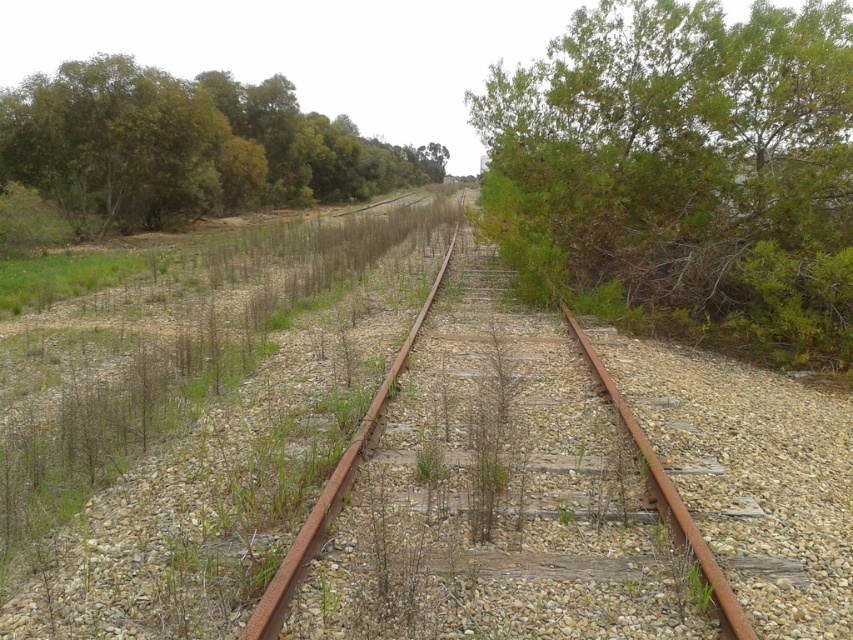
Question: Does rusty metal track at center have a larger size compared to green leafy tree at upper left?

Choices:
 (A) yes
 (B) no

Answer: (B)

Question: Does rusty metal track at center appear on the right side of green leafy tree at upper left?

Choices:
 (A) no
 (B) yes

Answer: (B)

Question: Which of the following is the closest to the observer?

Choices:
 (A) rusty metal track at center
 (B) green leafy bush at right

Answer: (A)

Question: Based on their relative distances, which object is farther from the green leafy tree at upper left?

Choices:
 (A) rusty metal track at center
 (B) green leafy bush at right

Answer: (A)

Question: Which point is closer to the camera?

Choices:
 (A) (111, 211)
 (B) (573, 611)

Answer: (B)

Question: Can you confirm if green leafy bush at right is smaller than green leafy tree at upper left?

Choices:
 (A) no
 (B) yes

Answer: (B)